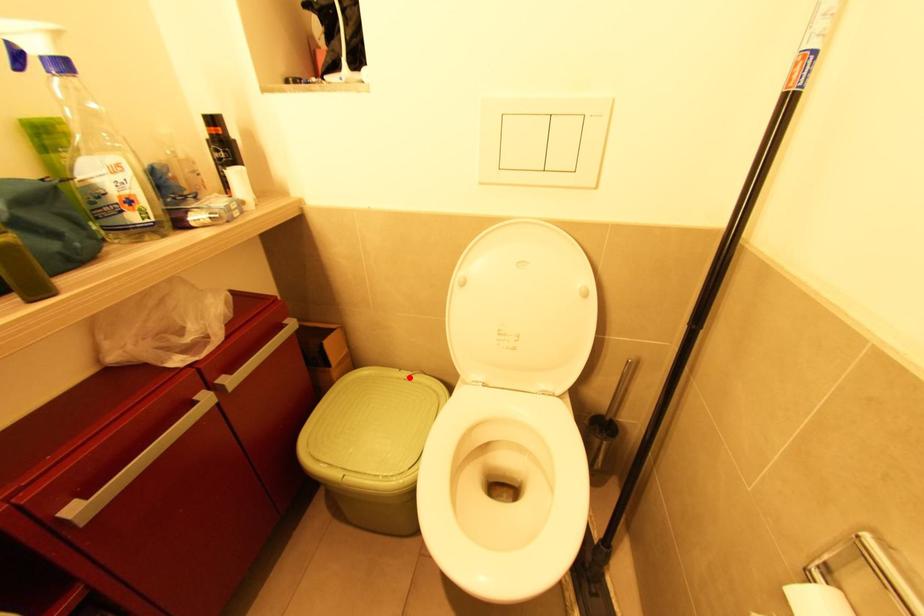
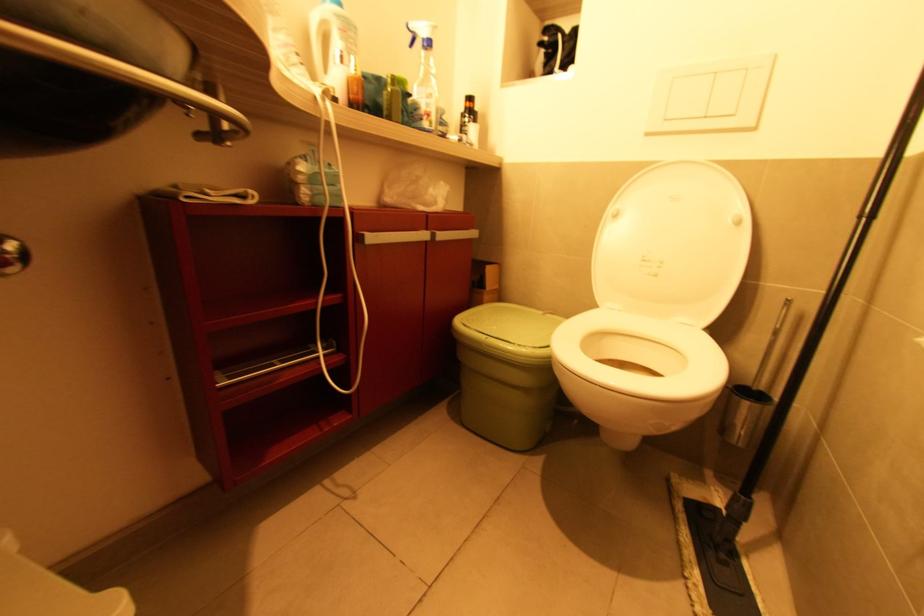
Find the pixel in the second image that matches the highlighted location in the first image.

(545, 314)